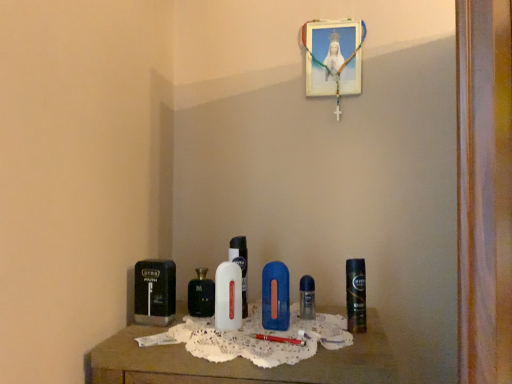
Identify the location of free space between white plastic bottle at center, the 2th perfume in the right-to-left sequence, and black plastic razor at left, the first personal care when ordered from left to right. Image resolution: width=512 pixels, height=384 pixels. click(186, 321).